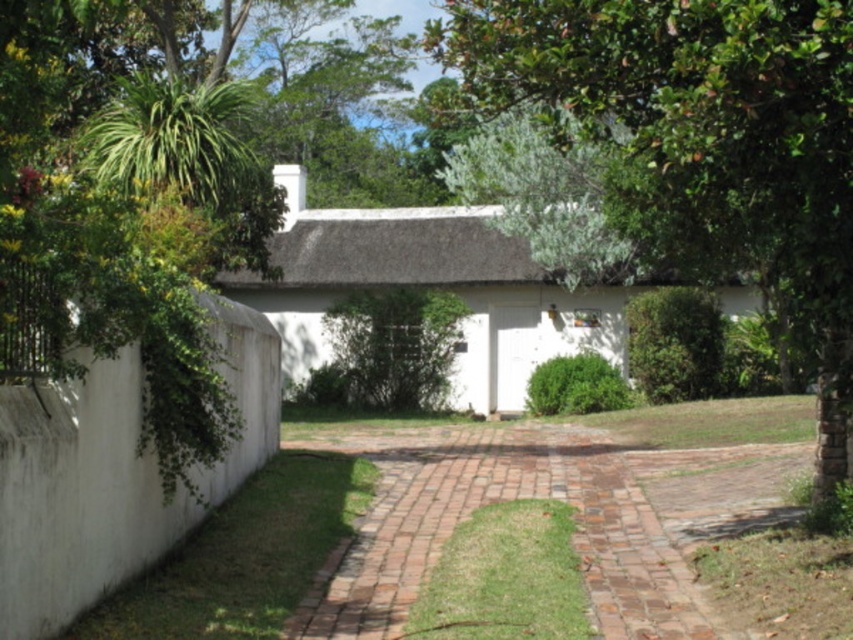
Is green leafy tree at center thinner than white matte cottage at center?

Indeed, green leafy tree at center has a lesser width compared to white matte cottage at center.

Is green leafy tree at center taller than white matte cottage at center?

Incorrect, green leafy tree at center's height is not larger of white matte cottage at center's.

Image resolution: width=853 pixels, height=640 pixels. Describe the element at coordinates (701, 145) in the screenshot. I see `green leafy tree at center` at that location.

You are a GUI agent. You are given a task and a screenshot of the screen. Output one action in this format:
    pyautogui.click(x=<x>, y=<y>)
    Task: Click on the green leafy tree at center
    The width and height of the screenshot is (853, 640).
    Given the screenshot: What is the action you would take?
    [x=701, y=145]

Measure the distance between green leafy tree at center and camera.

The distance of green leafy tree at center from camera is 5.41 meters.

Can you confirm if green leafy tree at center is taller than brick paved path at center?

Correct, green leafy tree at center is much taller as brick paved path at center.

I want to click on green leafy tree at center, so click(x=701, y=145).

This screenshot has width=853, height=640. What are the coordinates of `green leafy tree at center` in the screenshot? It's located at click(x=701, y=145).

Does brick paved path at center have a greater height compared to white matte cottage at center?

No, brick paved path at center is not taller than white matte cottage at center.

Which is more to the left, brick paved path at center or white matte cottage at center?

From the viewer's perspective, white matte cottage at center appears more on the left side.

Does point (374, 435) lie in front of point (463, 232)?

That is True.

Find the location of `brick paved path at center`. brick paved path at center is located at coordinates (544, 497).